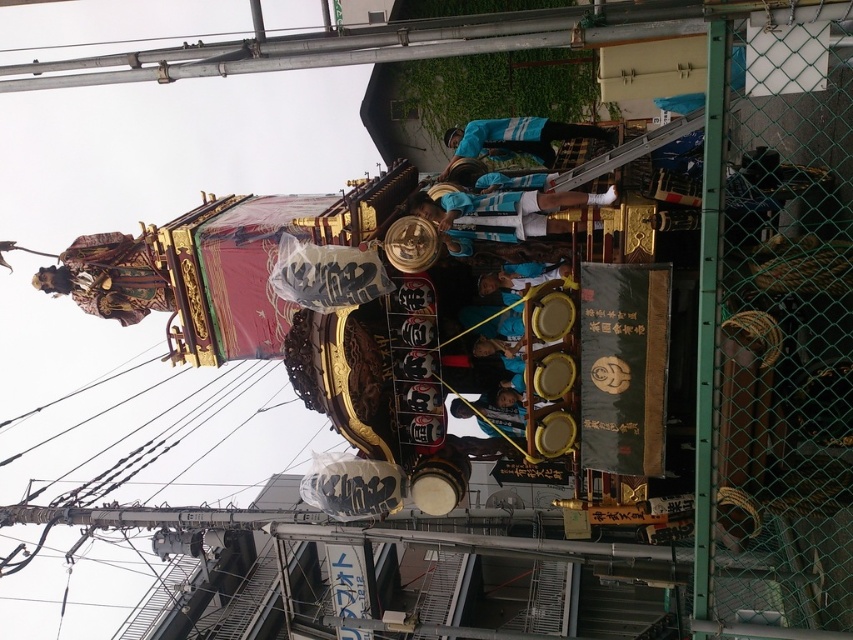
You are a photographer standing at the back of the festival crowd. You want to take a photo that includes both the white jersey at center and the blue fabric skateboarder at center. Given that your camera has a maximum focus range of 40 feet, will you be able to capture both subjects in focus without moving closer?

The distance between the white jersey at center and the blue fabric skateboarder at center is 44.48 feet. Since your camera can only focus up to 40 feet, you won cannot capture both subjects in focus without moving closer.